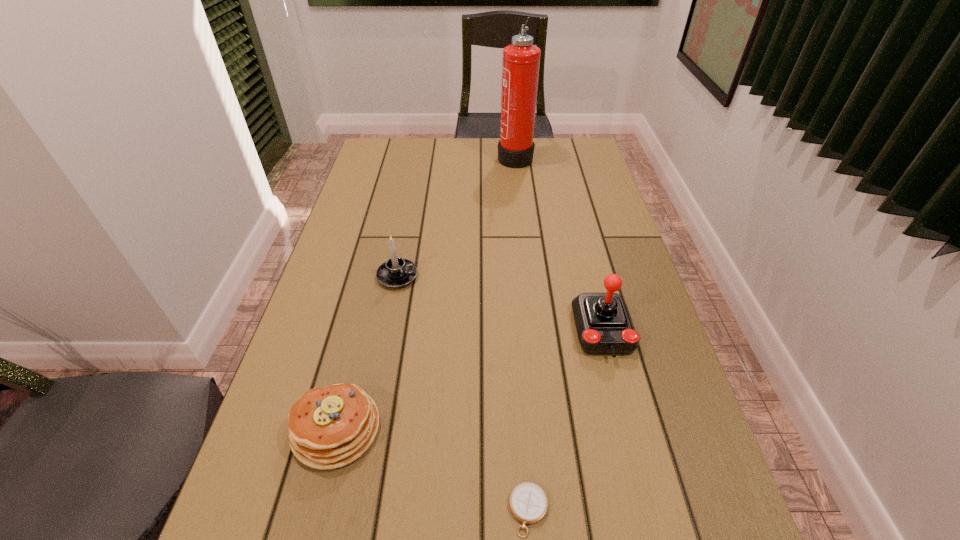
Where is `vacant region at the far edge of the desktop`? The image size is (960, 540). vacant region at the far edge of the desktop is located at coordinates (481, 155).

Image resolution: width=960 pixels, height=540 pixels. I want to click on blank space at the left edge of the desktop, so click(371, 216).

Identify the location of free region at the right edge of the desktop. (671, 410).

Find the location of a particular element. This screenshot has width=960, height=540. vacant space that is in between the fourth farthest object and the compass is located at coordinates (433, 469).

Identify the location of free space between the farthest object and the joystick. The image size is (960, 540). (559, 244).

You are a GUI agent. You are given a task and a screenshot of the screen. Output one action in this format:
    pyautogui.click(x=<x>, y=<y>)
    Task: Click on the free spot between the farthest object and the nearest object
    This screenshot has width=960, height=540.
    Given the screenshot: What is the action you would take?
    point(522,333)

Image resolution: width=960 pixels, height=540 pixels. What are the coordinates of `unoccupied area between the second shortest object and the candle holder` in the screenshot? It's located at (367, 352).

The width and height of the screenshot is (960, 540). I want to click on vacant space that is in between the second farthest object and the second shortest object, so click(x=367, y=352).

Locate an element on the screen. The width and height of the screenshot is (960, 540). free space between the pancake and the candle holder is located at coordinates (367, 352).

Locate an element on the screen. The image size is (960, 540). blank region between the candle holder and the fire extinguisher is located at coordinates (456, 216).